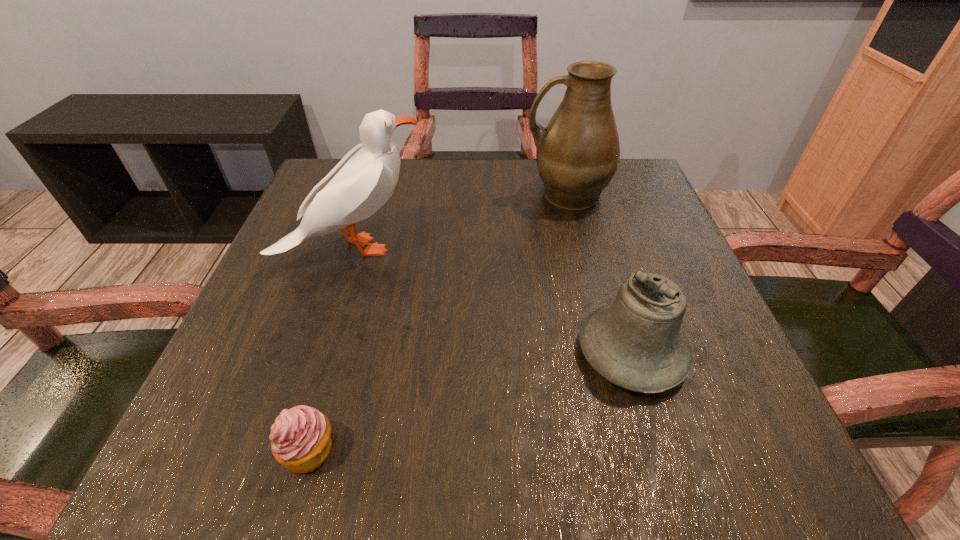
This screenshot has height=540, width=960. In order to click on vacant region that satisfies the following two spatial constraints: 1. at the beak of the gull; 2. on the left side of the second nearest object in this screenshot , I will do `click(320, 353)`.

Where is `blank area in the image that satisfies the following two spatial constraints: 1. at the beak of the gull; 2. on the right side of the third farthest object`? This screenshot has height=540, width=960. blank area in the image that satisfies the following two spatial constraints: 1. at the beak of the gull; 2. on the right side of the third farthest object is located at coordinates (320, 353).

At what (x,y) coordinates should I click in order to perform the action: click on free spot that satisfies the following two spatial constraints: 1. on the back side of the cupcake; 2. at the beak of the third nearest object. Please return your answer as a coordinate pair (x, y). Looking at the image, I should click on (367, 248).

Locate an element on the screen. free spot that satisfies the following two spatial constraints: 1. at the beak of the nearest object; 2. on the right side of the gull is located at coordinates (288, 450).

You are a GUI agent. You are given a task and a screenshot of the screen. Output one action in this format:
    pyautogui.click(x=<x>, y=<y>)
    Task: Click on the vacant space that satisfies the following two spatial constraints: 1. at the beak of the second shortest object; 2. on the left side of the second farthest object
    This screenshot has width=960, height=540.
    Given the screenshot: What is the action you would take?
    pyautogui.click(x=320, y=353)

Identify the location of vacant point that satisfies the following two spatial constraints: 1. at the beak of the third nearest object; 2. on the right side of the bell. This screenshot has height=540, width=960. tap(320, 353).

You are a GUI agent. You are given a task and a screenshot of the screen. Output one action in this format:
    pyautogui.click(x=<x>, y=<y>)
    Task: Click on the vacant area that satisfies the following two spatial constraints: 1. at the beak of the second shortest object; 2. on the left side of the third nearest object
    The width and height of the screenshot is (960, 540).
    Given the screenshot: What is the action you would take?
    pyautogui.click(x=320, y=353)